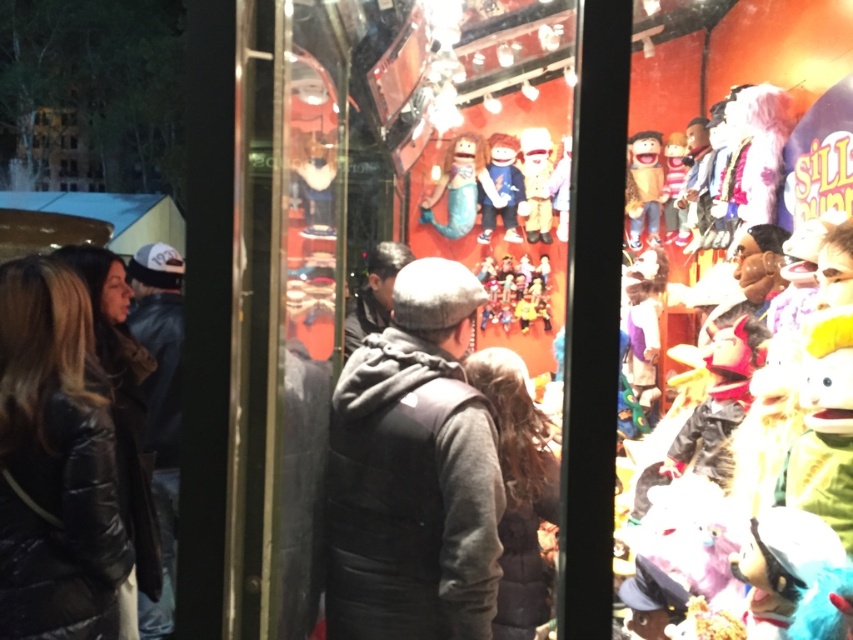
Is matte wooden dolls at center shorter than matte yellow plush at upper right?

No.

Can you confirm if matte wooden dolls at center is thinner than matte yellow plush at upper right?

No.

Between point (355, 125) and point (630, 205), which one is positioned behind?

The point (630, 205) is more distant.

Locate an element on the screen. The image size is (853, 640). matte wooden dolls at center is located at coordinates (326, 244).

Locate an element on the screen. The image size is (853, 640). velvet plush doll at center is located at coordinates (502, 188).

In the scene shown: Between velvet plush doll at center and matte white plush toy at center, which one appears on the right side from the viewer's perspective?

matte white plush toy at center

This screenshot has width=853, height=640. In order to click on velvet plush doll at center in this screenshot , I will do `click(502, 188)`.

The image size is (853, 640). I want to click on velvet plush doll at center, so click(x=502, y=188).

Is black puffy jacket at left shorter than velvet plush doll at center?

In fact, black puffy jacket at left may be taller than velvet plush doll at center.

Which is above, black puffy jacket at left or velvet plush doll at center?

velvet plush doll at center is above.

Does point (45, 256) come behind point (482, 220)?

No.

Identify the location of black puffy jacket at left. (55, 464).